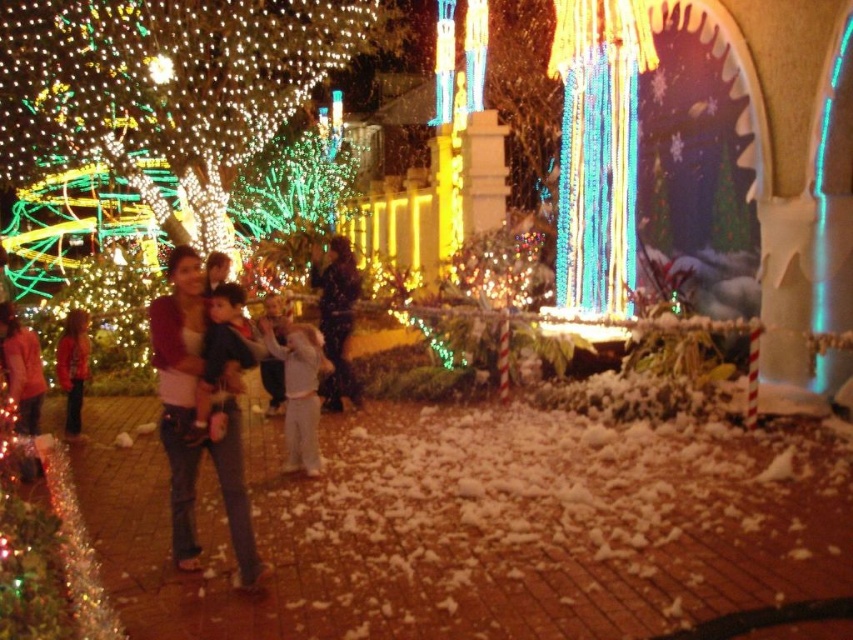
Question: Can you confirm if denim jeans at center is positioned below white cotton pants at center?

Choices:
 (A) no
 (B) yes

Answer: (A)

Question: Is white cotton pants at center further to the viewer compared to red cotton sweater at left?

Choices:
 (A) yes
 (B) no

Answer: (B)

Question: Estimate the real-world distances between objects in this image. Which object is farther from the denim jeans at center?

Choices:
 (A) white cotton pants at center
 (B) dark blue jeans at center
 (C) red cotton sweater at left

Answer: (B)

Question: Does white cotton pants at center lie in front of red cotton sweater at left?

Choices:
 (A) yes
 (B) no

Answer: (A)

Question: Based on their relative distances, which object is farther from the dark blue jeans at center?

Choices:
 (A) white cotton pants at center
 (B) denim jeans at center

Answer: (B)

Question: Estimate the real-world distances between objects in this image. Which object is closer to the red cotton sweater at left?

Choices:
 (A) dark blue jeans at center
 (B) denim jeans at center

Answer: (B)